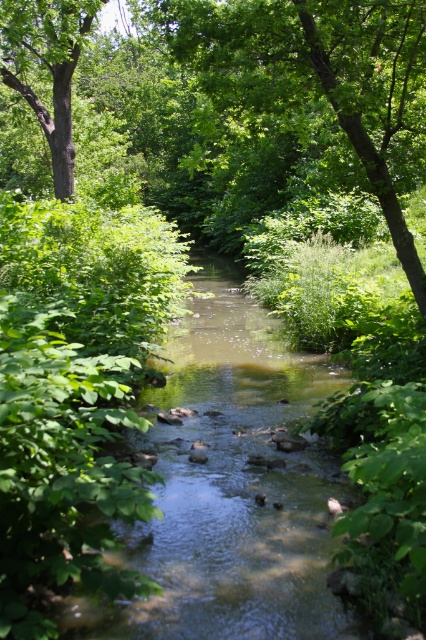
Question: Is green leafy tree at center positioned in front of brown rough tree at left?

Choices:
 (A) no
 (B) yes

Answer: (B)

Question: Which object appears farthest from the camera in this image?

Choices:
 (A) green leafy tree at center
 (B) brown rough tree at left

Answer: (B)

Question: Among these objects, which one is farthest from the camera?

Choices:
 (A) brown rough tree at left
 (B) green leafy tree at center

Answer: (A)

Question: Is green leafy tree at center wider than brown rough tree at left?

Choices:
 (A) no
 (B) yes

Answer: (A)

Question: Among these objects, which one is farthest from the camera?

Choices:
 (A) green leafy tree at center
 (B) brown rough tree at left

Answer: (B)

Question: Is green leafy tree at center to the right of brown rough tree at left from the viewer's perspective?

Choices:
 (A) yes
 (B) no

Answer: (A)